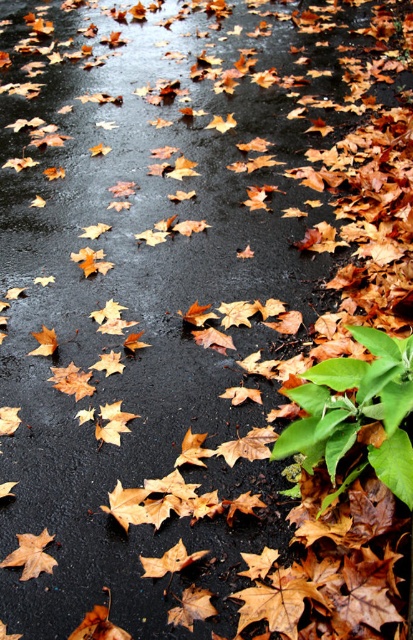
You are a leaf collector who wants to compare the sizes of the leaves in the image. Which leaf is taller between the brown matte maple leaf at lower center and the orange matte maple leaf at center?

The brown matte maple leaf at lower center is taller than the orange matte maple leaf at center.

Consider the image. You are a leaf collector who wants to compare the sizes of the leaves in the image. Which leaf is taller between the brown matte maple leaf at lower left and the orange matte maple leaf at center?

The brown matte maple leaf at lower left is much taller than the orange matte maple leaf at center.

You are an artist wanting to paint the scene. You notice two maple leaves on the asphalt. Which maple leaf has a smaller width, the brown matte maple leaf at lower left or the orange matte maple leaf at center?

The brown matte maple leaf at lower left has a lesser width compared to the orange matte maple leaf at center, so it is the smaller one.